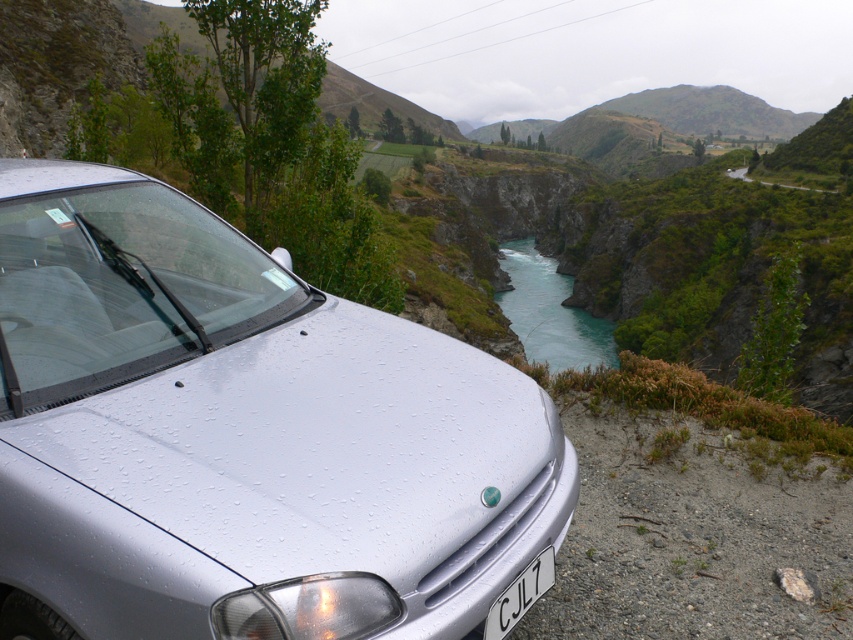
Who is lower down, satin silver car at center or turquoise smooth water at center?

satin silver car at center is below.

Between satin silver car at center and turquoise smooth water at center, which one has more height?

turquoise smooth water at center is taller.

Where is `satin silver car at center`? The height and width of the screenshot is (640, 853). satin silver car at center is located at coordinates (241, 435).

Does turquoise smooth water at center come in front of black plastic license plate at bottom center?

No.

Who is positioned more to the right, turquoise smooth water at center or black plastic license plate at bottom center?

turquoise smooth water at center

Identify the location of turquoise smooth water at center. This screenshot has height=640, width=853. (550, 312).

Is point (125, 589) positioned after point (508, 611)?

No, it is not.

Does satin silver car at center appear on the left side of black plastic license plate at bottom center?

Yes, satin silver car at center is to the left of black plastic license plate at bottom center.

At what (x,y) coordinates should I click in order to perform the action: click on satin silver car at center. Please return your answer as a coordinate pair (x, y). Image resolution: width=853 pixels, height=640 pixels. Looking at the image, I should click on (241, 435).